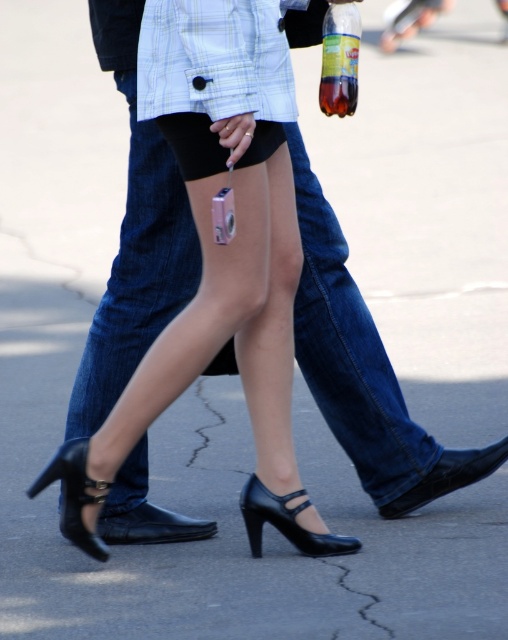
In the scene shown: You are a photographer trying to capture a candid shot of the woman in the scene. You notice the black leather heel at lower left and the translucent plastic bottle at center. Which object is shorter in height?

The black leather heel at lower left is not as tall as the translucent plastic bottle at center, so the black leather heel at lower left is shorter.

You are a photographer trying to capture a candid shot of the two people walking. The camera you have can focus on subjects within 5 meters. Are both the black patent leather heel at lower center and the other person visible in your camera frame?

The two people are 4.38 meters apart, so the distance between them is within the camera focus range of 5 meters. Therefore, both the black patent leather heel at lower center and the other person are visible in the camera frame.